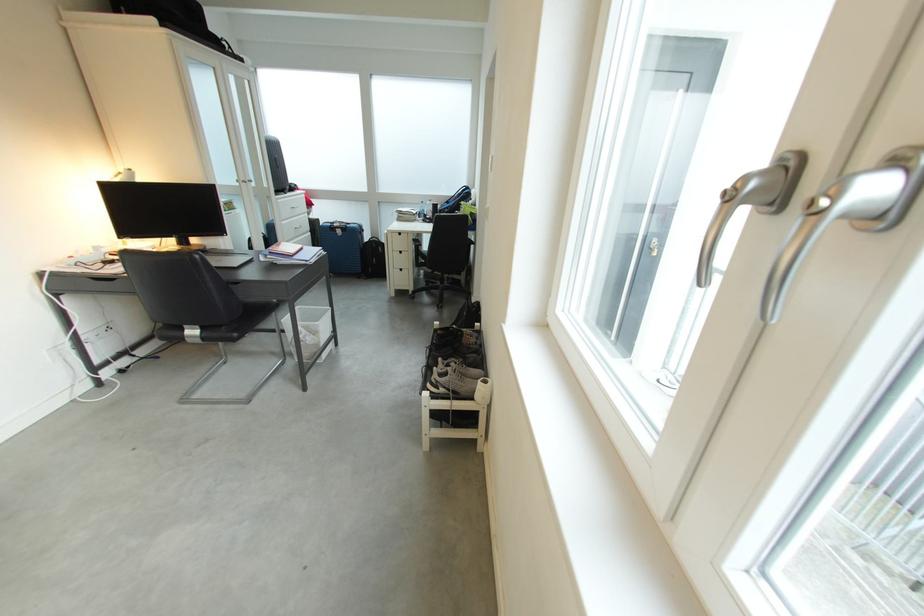
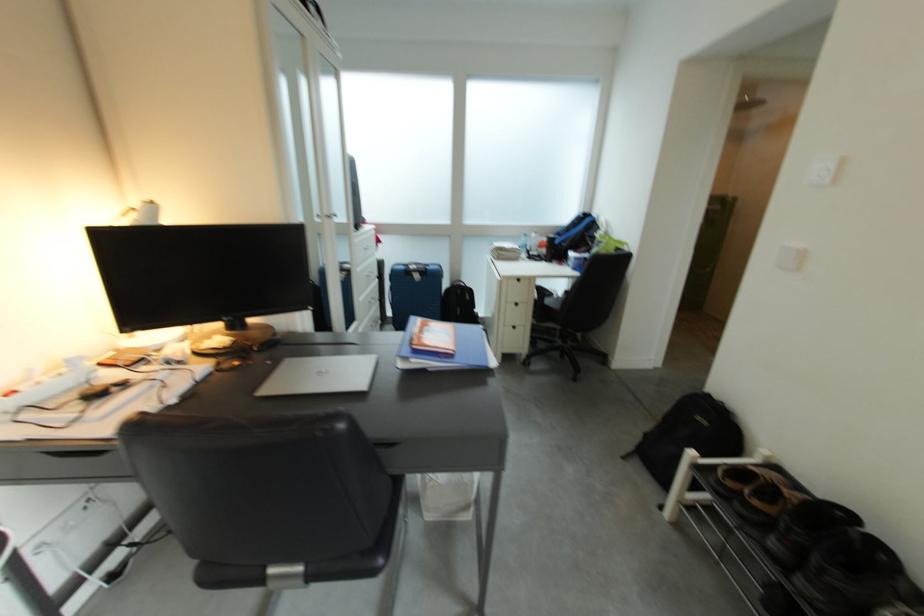
In a continuous first-person perspective shot, in which direction is the camera moving?

The cameraman walked toward left, forward.